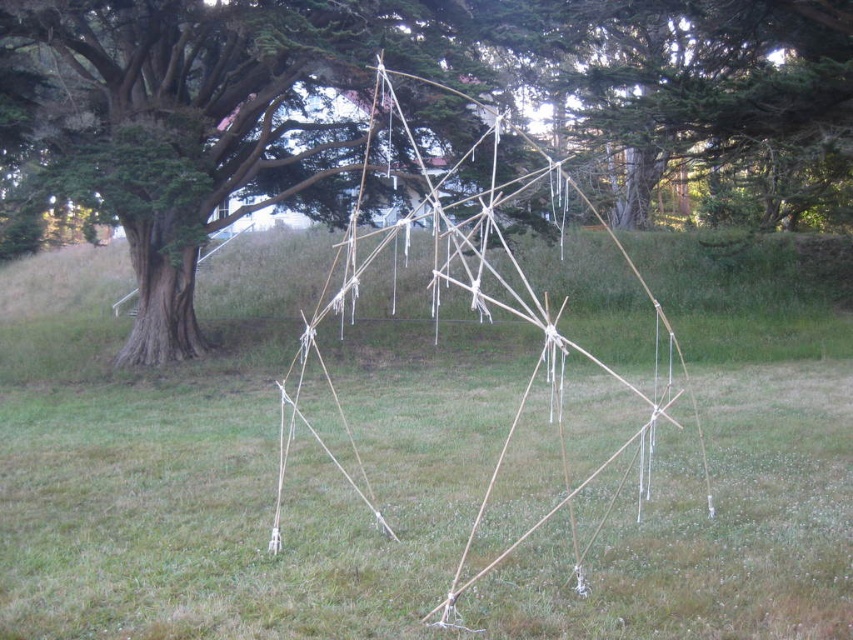
Question: Considering the real-world distances, which object is closest to the green grass at center?

Choices:
 (A) brown wood tree at center
 (B) natural wood stick structure at center

Answer: (B)

Question: Can you confirm if brown wood tree at center is positioned below natural wood stick structure at center?

Choices:
 (A) yes
 (B) no

Answer: (B)

Question: Does green grass at center come behind brown wood tree at center?

Choices:
 (A) no
 (B) yes

Answer: (A)

Question: Can you confirm if green grass at center is positioned below brown wood tree at center?

Choices:
 (A) yes
 (B) no

Answer: (A)

Question: Which point is closer to the camera?

Choices:
 (A) (577, 67)
 (B) (343, 417)

Answer: (B)

Question: Which point appears closest to the camera in this image?

Choices:
 (A) (282, 388)
 (B) (413, 129)

Answer: (A)